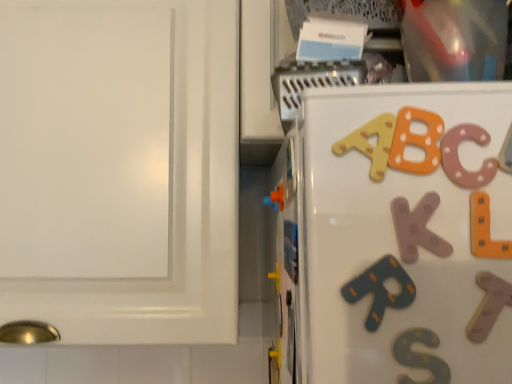
Question: Is orange matte magnet at center wider or thinner than white glossy cabinet at upper right?

Choices:
 (A) thin
 (B) wide

Answer: (A)

Question: Would you say orange matte magnet at center is to the left or to the right of white glossy cabinet at upper right in the picture?

Choices:
 (A) left
 (B) right

Answer: (B)

Question: Which of these objects is positioned farthest from the orange matte magnet at center?

Choices:
 (A) white glossy cabinet at upper right
 (B) orange matte toy at center

Answer: (A)

Question: Based on their relative distances, which object is farther from the white glossy cabinet at upper right?

Choices:
 (A) orange matte toy at center
 (B) orange matte magnet at center

Answer: (B)